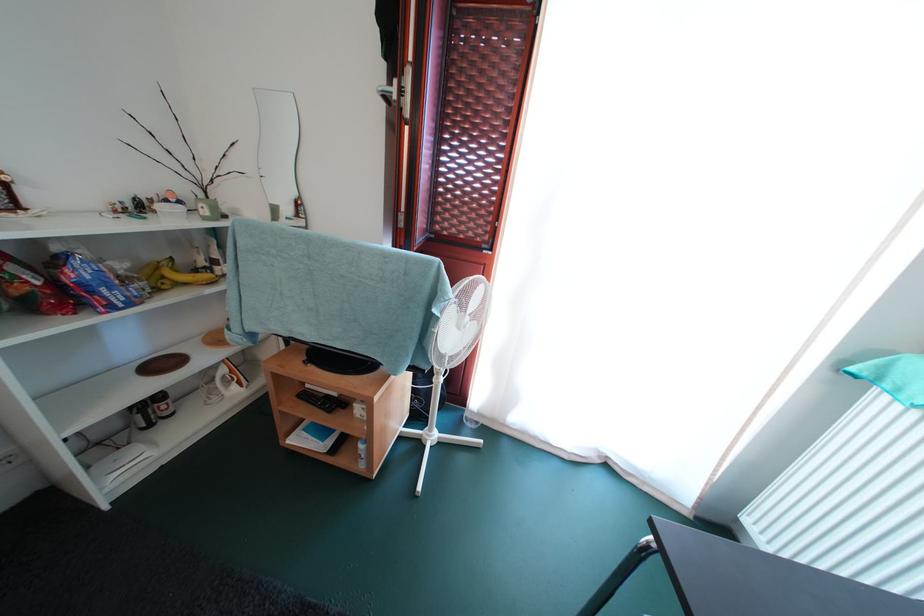
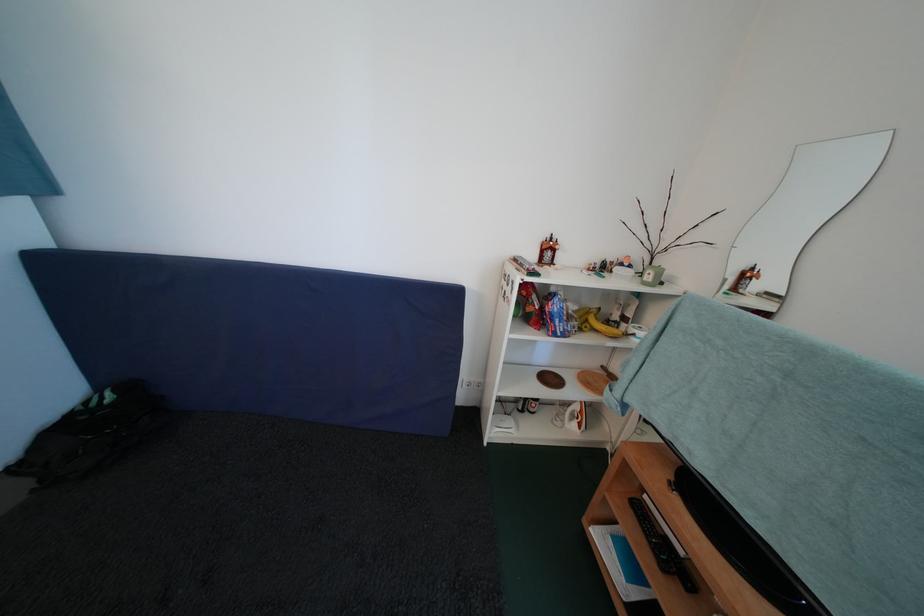
The point at (x=111, y=296) is marked in the first image. Where is the corresponding point in the second image?

(565, 326)